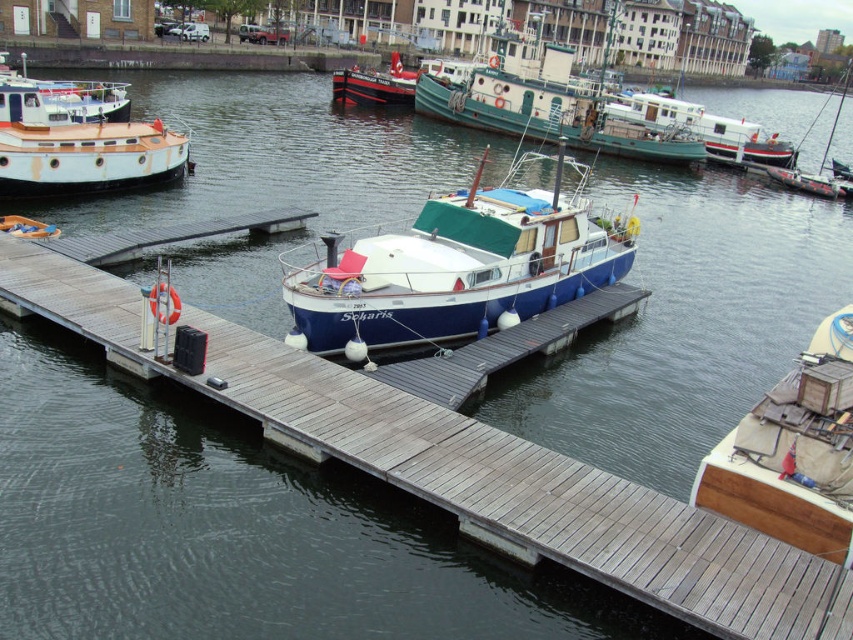
Between point (363, 92) and point (846, 76), which one is positioned behind?

Point (846, 76)

Based on the photo, measure the distance between red polished wood boat at center and camera.

red polished wood boat at center and camera are 169.49 feet apart from each other.

You are a GUI agent. You are given a task and a screenshot of the screen. Output one action in this format:
    pyautogui.click(x=<x>, y=<y>)
    Task: Click on the red polished wood boat at center
    The height and width of the screenshot is (640, 853).
    Given the screenshot: What is the action you would take?
    pyautogui.click(x=375, y=84)

Does point (32, 164) come farther from viewer compared to point (824, 157)?

No, it is in front of (824, 157).

Who is more forward, (44, 189) or (787, 186)?

Positioned in front is point (44, 189).

Which is behind, point (88, 116) or point (805, 173)?

Positioned behind is point (805, 173).

Where is `white wooden boat at left`? The width and height of the screenshot is (853, 640). white wooden boat at left is located at coordinates (78, 141).

Is wooden deck at center taller than wooden dock at center?

Correct, wooden deck at center is much taller as wooden dock at center.

Who is shorter, wooden deck at center or wooden dock at center?

Standing shorter between the two is wooden dock at center.

Identify the location of wooden deck at center. (793, 452).